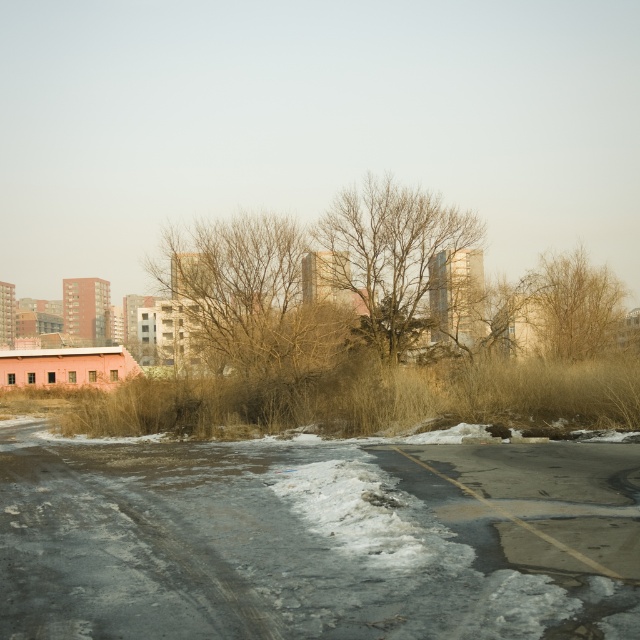
Question: Is white powdery snow at center further to camera compared to brown dry grass at right?

Choices:
 (A) no
 (B) yes

Answer: (A)

Question: Which is nearer to the brown dry grass at right?

Choices:
 (A) white powdery snow at center
 (B) bare branches at center

Answer: (B)

Question: Is white powdery snow at center to the left of bare branches at center from the viewer's perspective?

Choices:
 (A) yes
 (B) no

Answer: (A)

Question: Can you confirm if white powdery snow at center is positioned below brown dry grass at right?

Choices:
 (A) yes
 (B) no

Answer: (A)

Question: Which object appears closest to the camera in this image?

Choices:
 (A) bare branches at center
 (B) brown dry grass at right
 (C) white powdery snow at center

Answer: (C)

Question: Which of these objects is positioned farthest from the white powdery snow at center?

Choices:
 (A) brown dry grass at right
 (B) bare branches at center

Answer: (A)